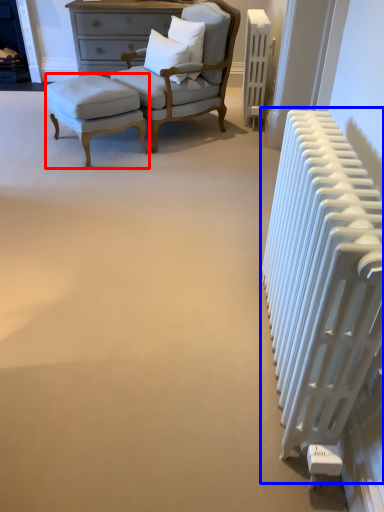
Question: Which point is further to the camera, stool (highlighted by a red box) or radiator (highlighted by a blue box)?

Choices:
 (A) stool
 (B) radiator

Answer: (A)